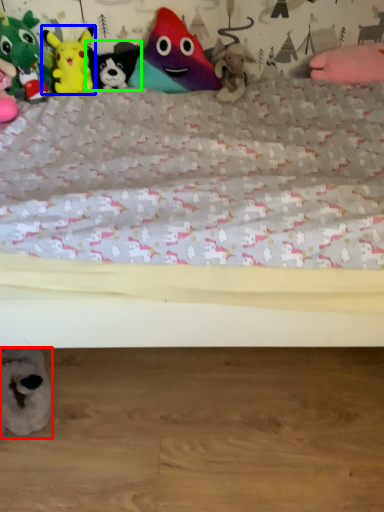
Question: Considering the real-world distances, which object is farthest from toy (highlighted by a red box)? toy (highlighted by a blue box) or toy (highlighted by a green box)?

Choices:
 (A) toy
 (B) toy

Answer: (B)